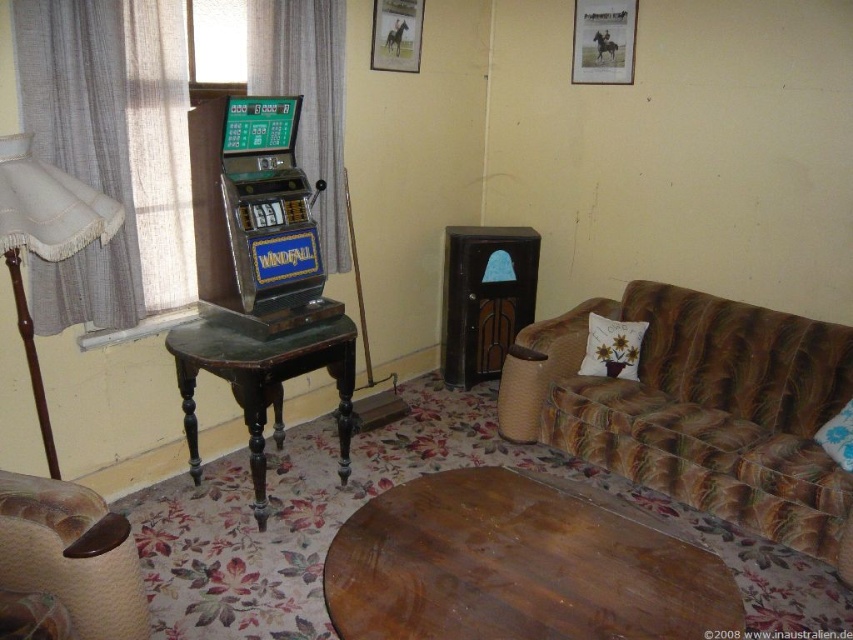
How far apart are metallic slot machine at left and leather armchair at lower left?

metallic slot machine at left is 3.62 feet from leather armchair at lower left.

Locate an element on the screen. metallic slot machine at left is located at coordinates (271, 216).

Is brown floral fabric couch at lower right wider than wooden table at center?

Correct, the width of brown floral fabric couch at lower right exceeds that of wooden table at center.

Which is behind, point (694, 477) or point (497, 520)?

The point (694, 477) is more distant.

Where is `brown floral fabric couch at lower right`? The image size is (853, 640). brown floral fabric couch at lower right is located at coordinates (699, 410).

Which of these two, brown floral fabric couch at lower right or metallic slot machine at left, stands taller?

brown floral fabric couch at lower right is taller.

Does brown floral fabric couch at lower right have a larger size compared to metallic slot machine at left?

Indeed, brown floral fabric couch at lower right has a larger size compared to metallic slot machine at left.

Who is more distant from viewer, (x=718, y=349) or (x=283, y=202)?

The point (x=718, y=349) is more distant.

Find the location of a particular element. brown floral fabric couch at lower right is located at coordinates (699, 410).